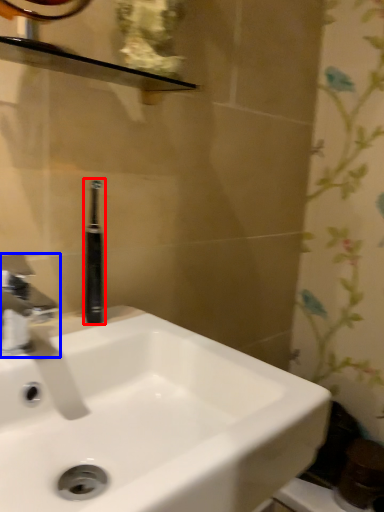
Question: Which object appears closest to the camera in this image, toiletry (highlighted by a red box) or tap (highlighted by a blue box)?

Choices:
 (A) toiletry
 (B) tap

Answer: (B)